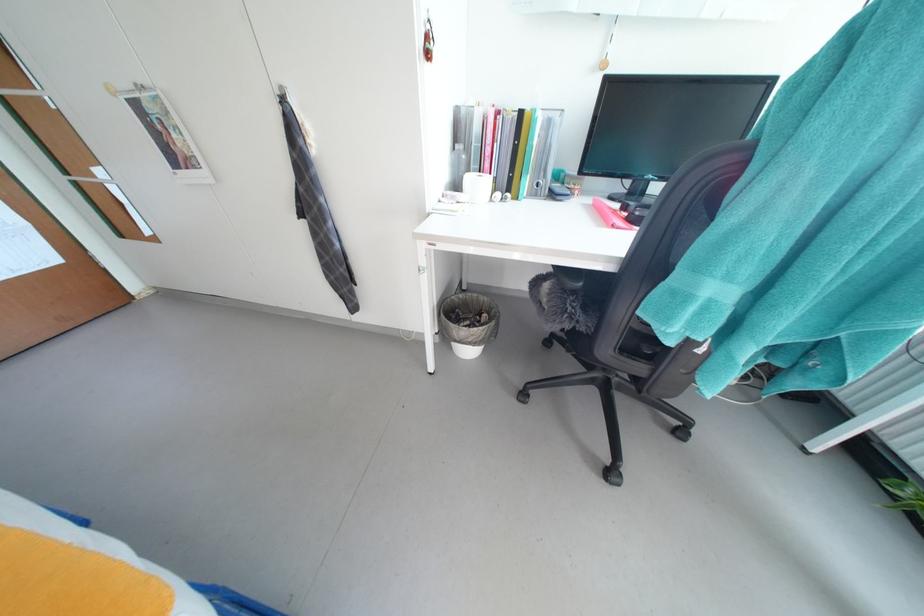
Which object does [611,216] point to?

It refers to a pink stapler.